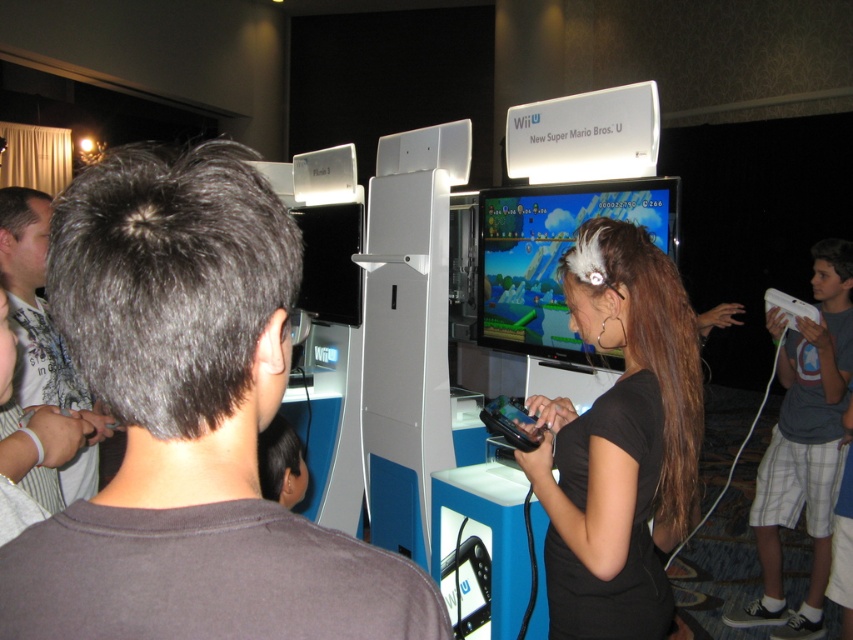
You are a photographer at the event and want to capture a closeup shot of the dark brown hair at center and the black matte hair clip at center. Your camera has a minimum focusing distance of 3 feet. Will you be able to take the photo without moving closer?

The distance between the dark brown hair at center and the black matte hair clip at center is 3.75 feet, which is greater than the camera minimum focusing distance of 3 feet. Therefore, you can take the photo without moving closer.

You are a photographer at the gaming event. You want to capture a photo of the dark brown hair at center and the white matte game controller at upper right in the same frame. Based on their positions, which object is located more to the left?

The dark brown hair at center is positioned on the left side of white matte game controller at upper right, so the dark brown hair at center is more to the left.

You are standing in the gaming event and want to move from the point closer to you to the point further away. Which path should you take? The points are labeled as point 1 at (225, 328) and point 2 at (773, 550). Please specify which point is closer and which is further based on their coordinates.

Point 1 at (225, 328) is closer to the viewer than point 2 at (773, 550). To move from the closer point to the further one, you should go from point 1 to point 2.